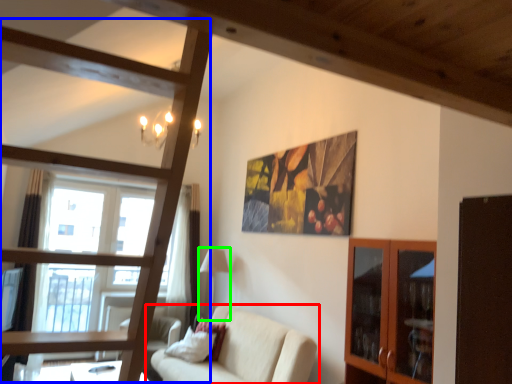
Question: Which is farther away from studio couch (highlighted by a red box)? bunk bed (highlighted by a blue box) or lamp (highlighted by a green box)?

Choices:
 (A) bunk bed
 (B) lamp

Answer: (A)